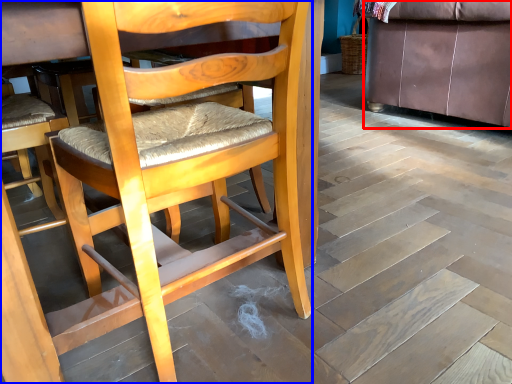
Question: Which of the following is the farthest to the observer, studio couch (highlighted by a red box) or chair (highlighted by a blue box)?

Choices:
 (A) studio couch
 (B) chair

Answer: (A)